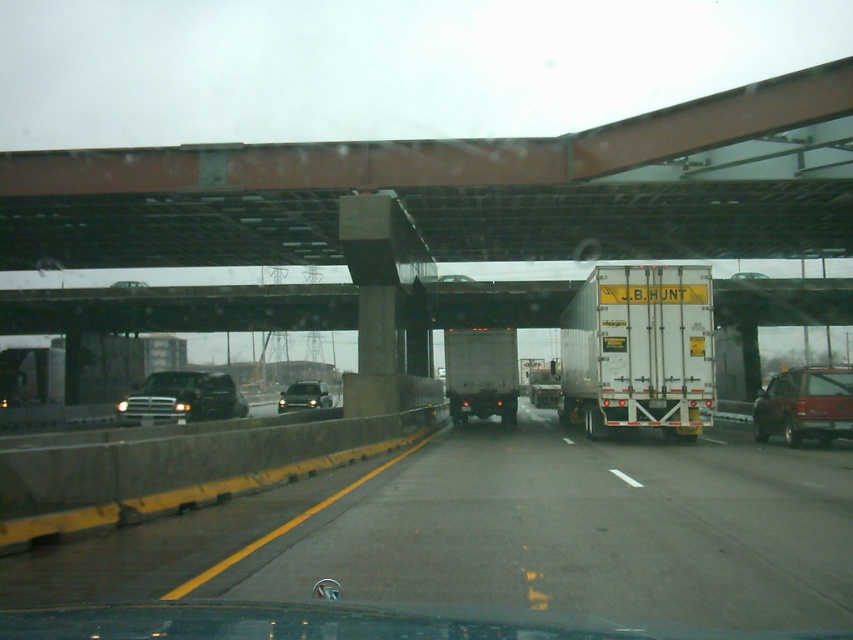
You are a passenger in the vehicle and notice two points marked in the scene. From your seat, which point, point (821, 385) or point (181, 403), is closer to you?

Point (821, 385) is closer to the camera than point (181, 403), so the point (821, 385) is closer to you.